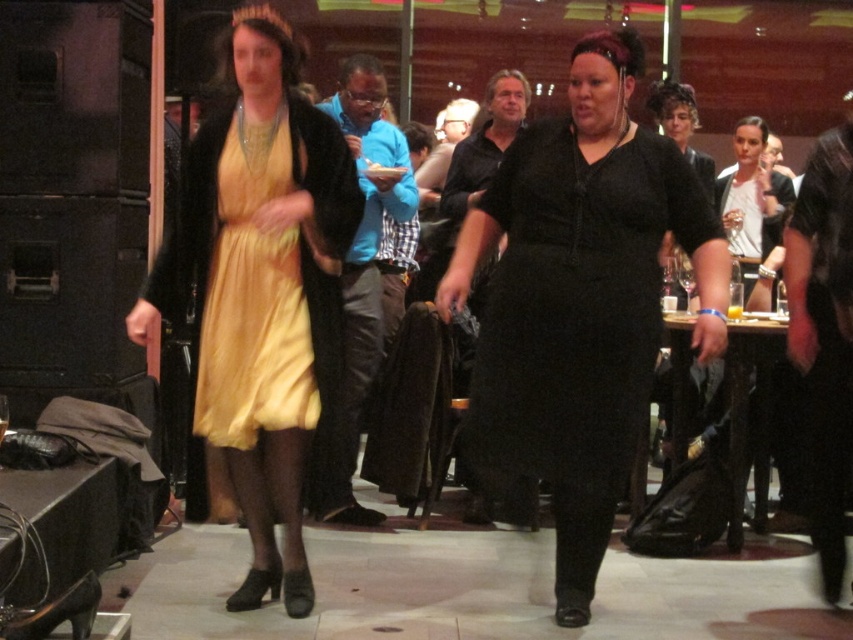
Does black velvet dress at center appear under satin yellow dress at center?

Indeed, black velvet dress at center is positioned under satin yellow dress at center.

What do you see at coordinates (579, 300) in the screenshot? This screenshot has width=853, height=640. I see `black velvet dress at center` at bounding box center [579, 300].

Which is behind, point (526, 387) or point (289, 573)?

The point (289, 573) is more distant.

Locate an element on the screen. black velvet dress at center is located at coordinates (579, 300).

Is point (606, 52) closer to viewer compared to point (312, 372)?

Yes.

Is black velvet dress at center below yellow satin dress at center?

Yes.

Where is `black velvet dress at center`? black velvet dress at center is located at coordinates click(579, 300).

The height and width of the screenshot is (640, 853). I want to click on black velvet dress at center, so click(579, 300).

Is point (274, 259) closer to camera compared to point (271, 324)?

No, it is behind (271, 324).

Consider the image. How distant is satin yellow dress at center from yellow satin dress at center?

A distance of 3.50 inches exists between satin yellow dress at center and yellow satin dress at center.

Does point (265, 19) come in front of point (265, 376)?

That is False.

Identify the location of satin yellow dress at center. point(259,298).